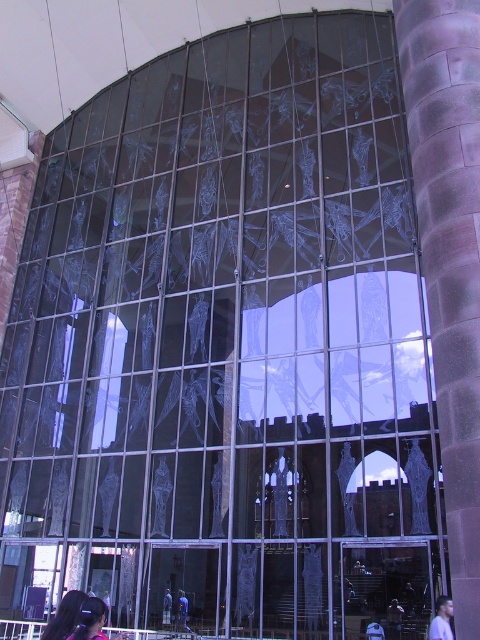
You are standing in front of the glass facade and notice a point marked at coordinates point (442, 620). What object is located at this point?

The point (442, 620) corresponds to the light blue shirt at lower right.

You are an architect reviewing a design for a glass facade. You notice an element labeled as the smooth black hair at lower left in the design. Where exactly is this element positioned in the grid layout of the glass panels?

The smooth black hair at lower left is positioned at point coordinates of 0.964 on the x axis and 0.135 on the y axis.